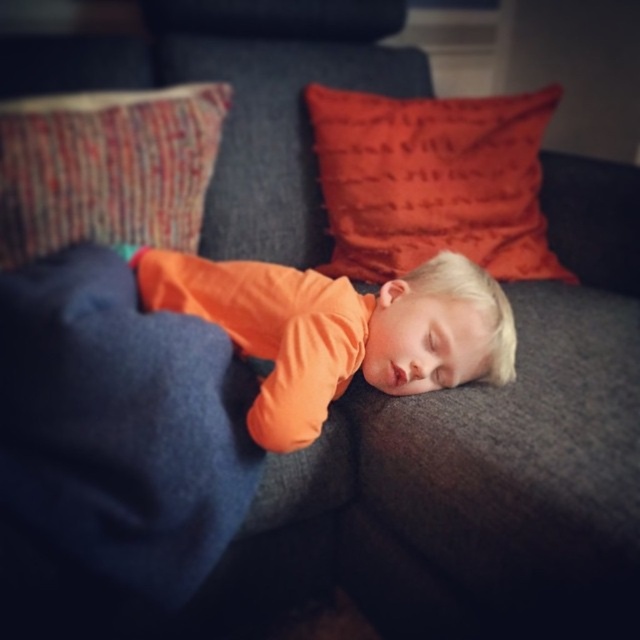
Does orange soft fabric toddler at center appear over velvety orange pillow at upper right?

No.

Is point (275, 268) farther from camera compared to point (493, 147)?

No, it is in front of (493, 147).

This screenshot has height=640, width=640. Identify the location of orange soft fabric toddler at center. (337, 330).

Between velvety orange pillow at upper right and textured woven pillow at upper left, which one appears on the right side from the viewer's perspective?

Positioned to the right is velvety orange pillow at upper right.

Who is more forward, (484, 148) or (189, 141)?

Point (189, 141)

The width and height of the screenshot is (640, 640). Find the location of `velvety orange pillow at upper right`. velvety orange pillow at upper right is located at coordinates (433, 180).

Based on the photo, which of these two, orange soft fabric toddler at center or textured woven pillow at upper left, stands taller?

Standing taller between the two is textured woven pillow at upper left.

Does point (300, 324) come behind point (17, 156)?

No, (300, 324) is closer to viewer.

Between point (452, 268) and point (166, 220), which one is positioned behind?

Positioned behind is point (166, 220).

Where is `orange soft fabric toddler at center`? The height and width of the screenshot is (640, 640). orange soft fabric toddler at center is located at coordinates (337, 330).